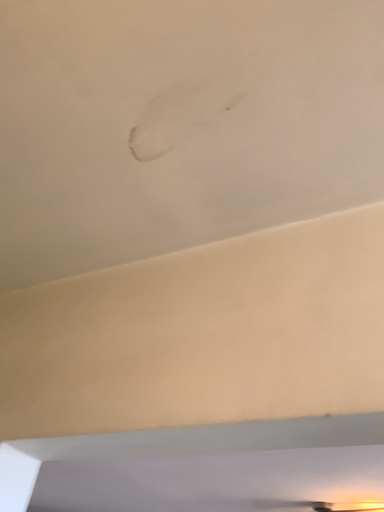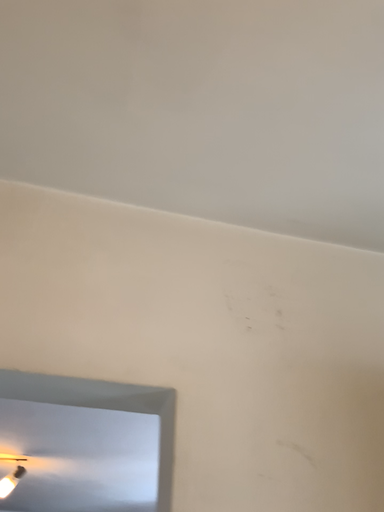
Question: How did the camera likely rotate when shooting the video?

Choices:
 (A) rotated downward
 (B) rotated upward

Answer: (A)